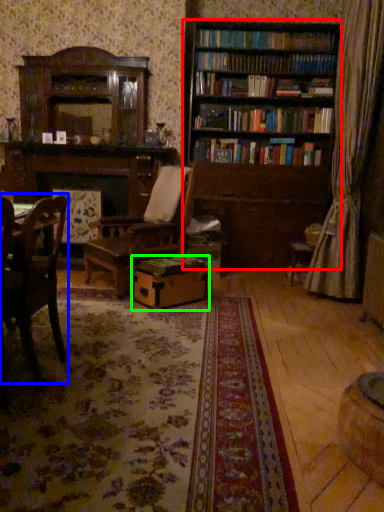
Question: Based on their relative distances, which object is nearer to bookcase (highlighted by a red box)? Choose from chair (highlighted by a blue box) and cardboard box (highlighted by a green box).

Choices:
 (A) chair
 (B) cardboard box

Answer: (B)